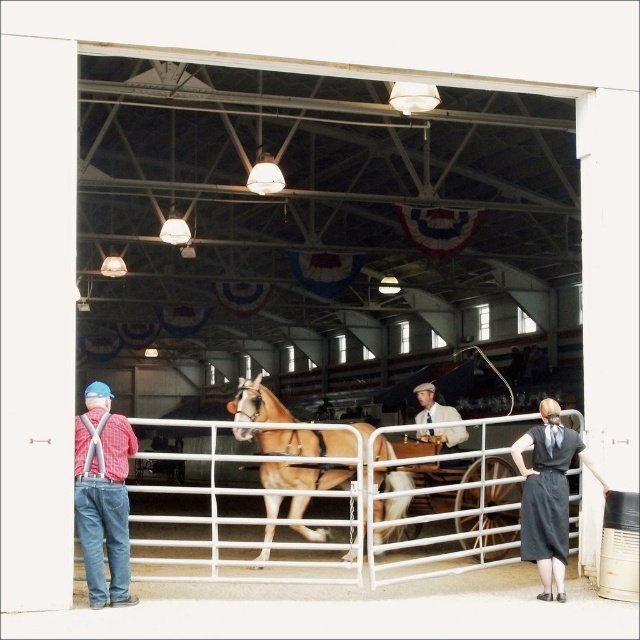
Does light brown leather horse at center appear under red plaid shirt at left?

Yes, light brown leather horse at center is below red plaid shirt at left.

Does light brown leather horse at center have a larger size compared to red plaid shirt at left?

Correct, light brown leather horse at center is larger in size than red plaid shirt at left.

Image resolution: width=640 pixels, height=640 pixels. Describe the element at coordinates (300, 442) in the screenshot. I see `light brown leather horse at center` at that location.

At what (x,y) coordinates should I click in order to perform the action: click on light brown leather horse at center. Please return your answer as a coordinate pair (x, y). Looking at the image, I should click on (300, 442).

Does light brown leather horse at center appear under dark gray fabric dress at lower right?

Indeed, light brown leather horse at center is positioned under dark gray fabric dress at lower right.

What do you see at coordinates (300, 442) in the screenshot? The height and width of the screenshot is (640, 640). I see `light brown leather horse at center` at bounding box center [300, 442].

The width and height of the screenshot is (640, 640). I want to click on light brown leather horse at center, so click(x=300, y=442).

Can you confirm if light brown leather horse at center is positioned below light brown leather jacket at center?

Yes, light brown leather horse at center is below light brown leather jacket at center.

Between point (326, 477) and point (456, 436), which one is positioned in front?

Point (326, 477)

In order to click on light brown leather horse at center in this screenshot , I will do `click(300, 442)`.